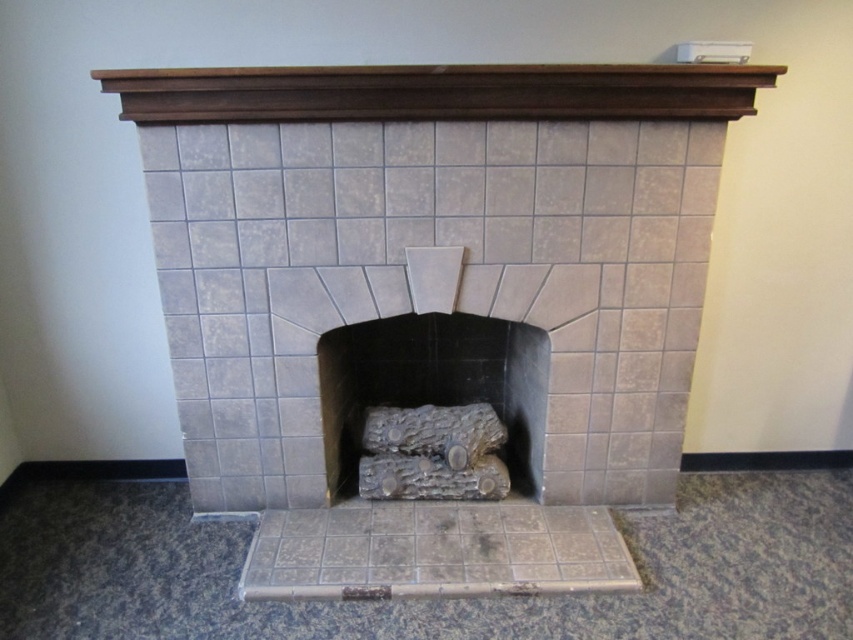
You are a firefighter assessing a room with a fireplace. You see the gray tile fireplace at center and the gray stone logs at center. Which object is positioned higher in the image?

The gray tile fireplace at center is located above the gray stone logs at center, so it is positioned higher in the image.

You are designing a living room and want to place a decorative item on the mantel above the gray tile fireplace at center. Considering the height of the fireplace and the gray stone logs at center, will the item need to be shorter than the fireplace to avoid blocking the view of the logs?

The gray tile fireplace at center is taller than the gray stone logs at center, so placing a decorative item on the mantel that is shorter than the fireplace will ensure it doesn not block the view of the logs.